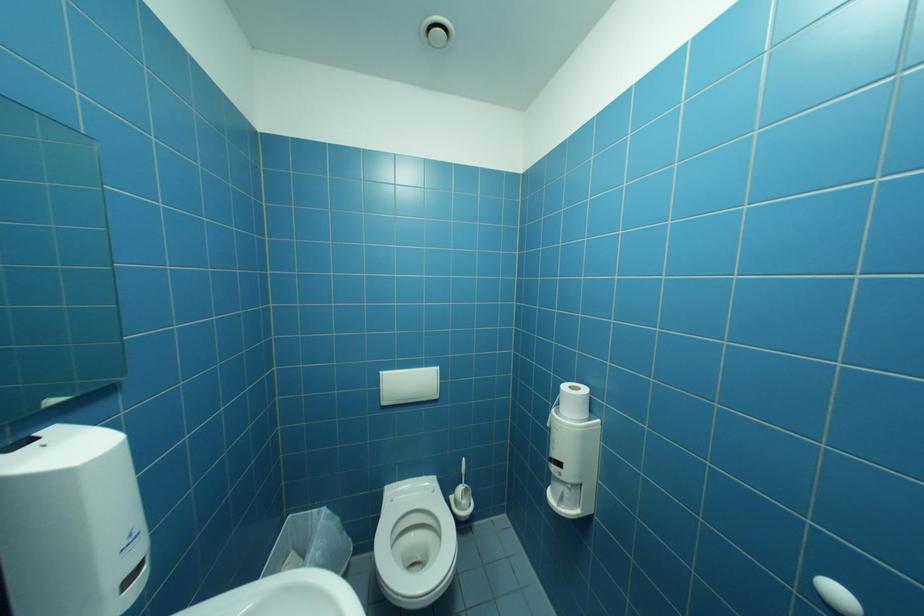
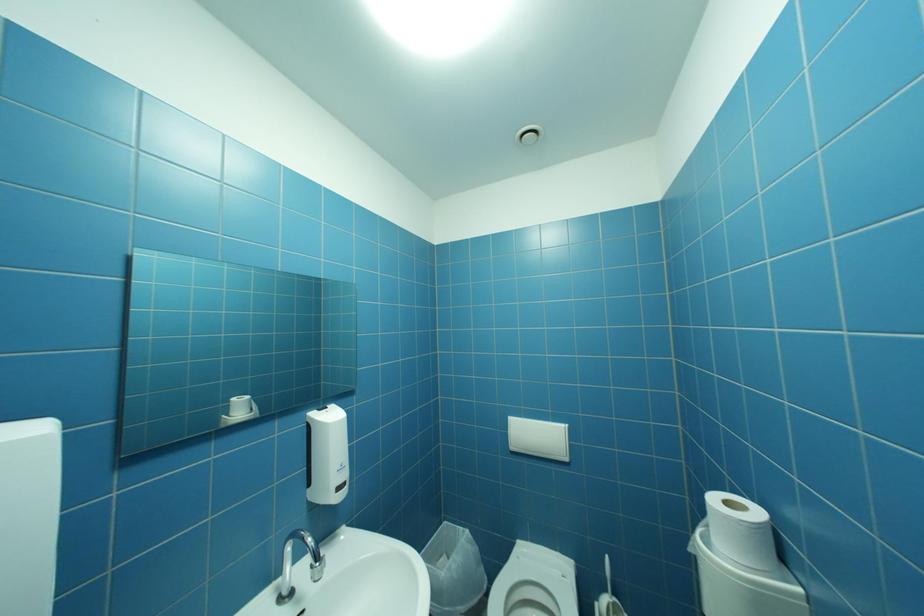
Question: The first image is from the beginning of the video and the second image is from the end. How did the camera likely rotate when shooting the video?

Choices:
 (A) Left
 (B) Right
 (C) Up
 (D) Down

Answer: (A)